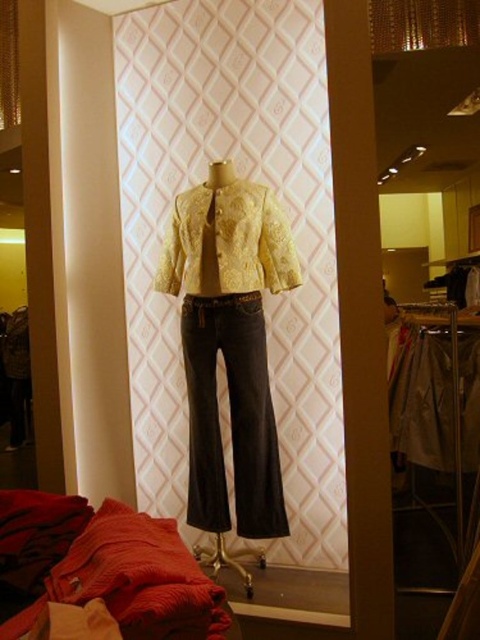
Does dark gray denim jeans at center come in front of white cotton shirt at center?

That is True.

Does point (220, 348) come closer to viewer compared to point (467, 428)?

Yes, point (220, 348) is closer to viewer.

The image size is (480, 640). Identify the location of dark gray denim jeans at center. (230, 417).